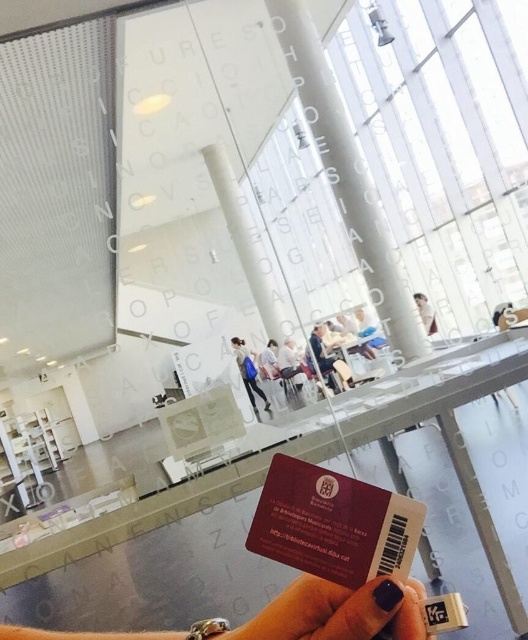
Question: Is light blue fabric chair at center to the right of white fabric shirt at upper center from the viewer's perspective?

Choices:
 (A) no
 (B) yes

Answer: (A)

Question: Which object appears closest to the camera in this image?

Choices:
 (A) white fabric shirt at upper center
 (B) light blue fabric chair at center

Answer: (B)

Question: Among these points, which one is nearest to the camera?

Choices:
 (A) (433, 326)
 (B) (282, 616)

Answer: (B)

Question: Does white fabric dress at center have a lesser width compared to white fabric shirt at upper center?

Choices:
 (A) yes
 (B) no

Answer: (B)

Question: Which object appears closest to the camera in this image?

Choices:
 (A) nail polish at center
 (B) light blue fabric chair at center
 (C) nail polish at lower center

Answer: (A)

Question: Can you confirm if nail polish at lower center is smaller than white fabric shirt at upper center?

Choices:
 (A) no
 (B) yes

Answer: (A)